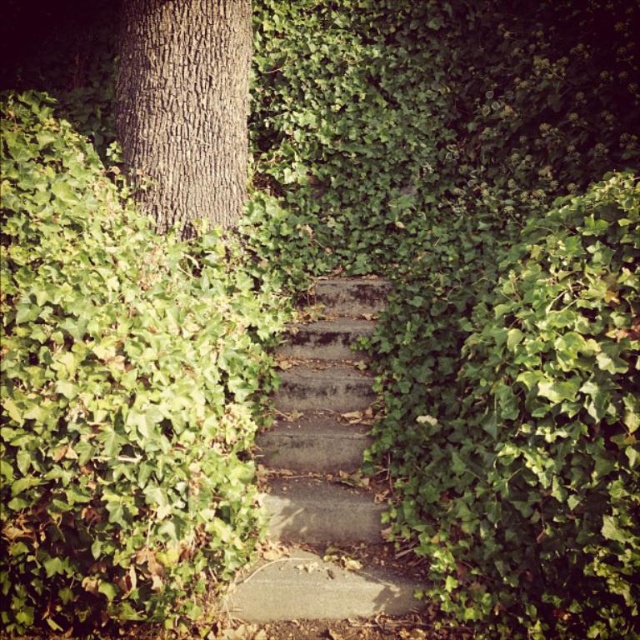
Find the location of `concrete steps at center`. concrete steps at center is located at coordinates (321, 474).

Is concrete steps at center smaller than smooth brown bark at upper left?

No, concrete steps at center is not smaller than smooth brown bark at upper left.

At what (x,y) coordinates should I click in order to perform the action: click on concrete steps at center. Please return your answer as a coordinate pair (x, y). The height and width of the screenshot is (640, 640). Looking at the image, I should click on (321, 474).

At what (x,y) coordinates should I click in order to perform the action: click on concrete steps at center. Please return your answer as a coordinate pair (x, y). The width and height of the screenshot is (640, 640). Looking at the image, I should click on (321, 474).